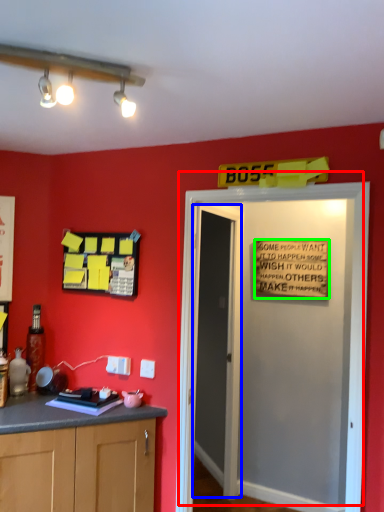
Question: Considering the real-world distances, which object is closest to door (highlighted by a red box)? door (highlighted by a blue box) or warning sign (highlighted by a green box).

Choices:
 (A) door
 (B) warning sign

Answer: (B)